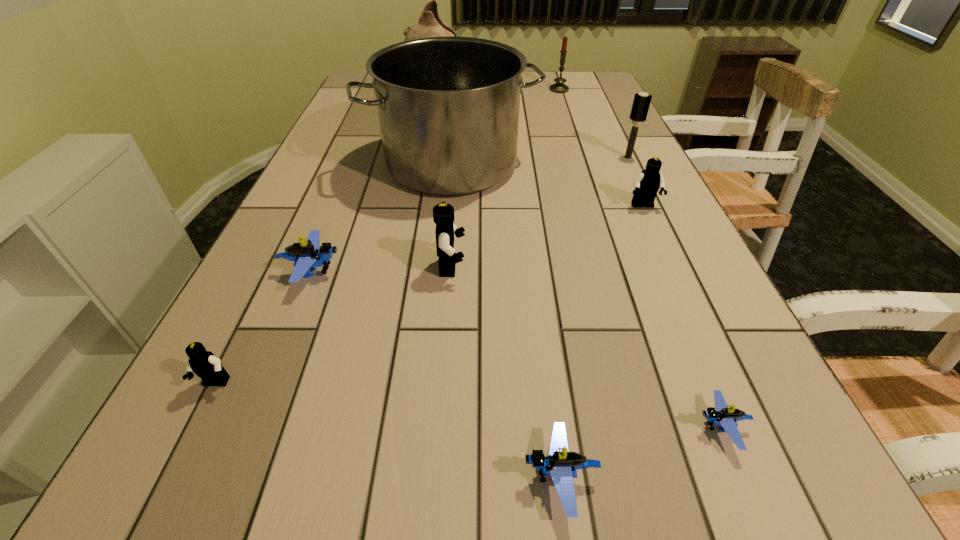
Locate an element on the screen. Image resolution: width=960 pixels, height=540 pixels. the farthest blue Lego is located at coordinates (308, 255).

You are a GUI agent. You are given a task and a screenshot of the screen. Output one action in this format:
    pyautogui.click(x=<x>, y=<y>)
    Task: Click on the leftmost black Lego
    This screenshot has height=540, width=960.
    Given the screenshot: What is the action you would take?
    point(204,364)

Image resolution: width=960 pixels, height=540 pixels. Find the location of `the smallest black Lego`. the smallest black Lego is located at coordinates (204, 364).

Where is `the second blue Lego from right to left`? the second blue Lego from right to left is located at coordinates (562, 465).

The height and width of the screenshot is (540, 960). I want to click on the fourth Lego from left to right, so click(x=562, y=465).

Locate an element on the screen. The image size is (960, 540). the shortest object is located at coordinates (720, 415).

The image size is (960, 540). Identify the location of the shortest Lego. (720, 415).

Where is `free space located 0.230m from the spout of the pottery`? The width and height of the screenshot is (960, 540). free space located 0.230m from the spout of the pottery is located at coordinates (528, 87).

The image size is (960, 540). In order to click on vacant space located 0.240m on the back of the saucepan in this screenshot , I will do `click(458, 100)`.

Find the location of a particular element. The image size is (960, 540). vacant region located 0.310m on the left of the hairbrush is located at coordinates (506, 157).